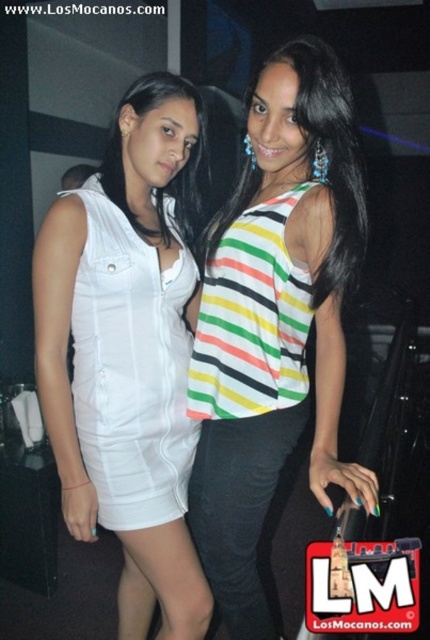
In the scene shown: You are at a party and want to approach the white satin dress at left and the striped fabric blouse at center. Which one should you walk towards first to get closer to both?

You should walk towards the white satin dress at left first because it is closer to you than the striped fabric blouse at center, so approaching it first will get you closer to both.

You are at a crowded event and need to navigate between the white matte dress at left and the white satin dress at left. Which dress has a wider silhouette to allow easier passage?

The white matte dress at left is wider than the white satin dress at left, so passing by the white matte dress at left would provide more space.